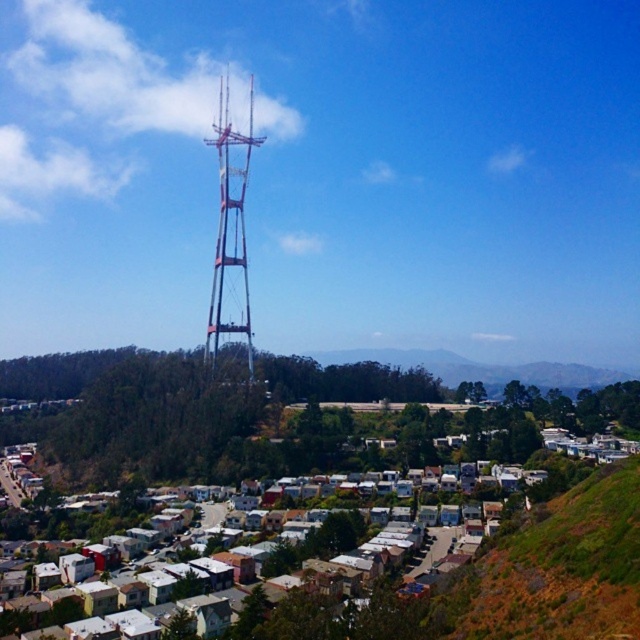
You are a drone operator planning to fly your drone from the green grassy hillside at lower right to the metallic silver tower at center. Based on the scene, will the tower be visible from the hillside without any obstructions?

Yes, the green grassy hillside at lower right is in front of the metallic silver tower at center, meaning there are no obstructions between them. The tower should be visible from the hillside.

You are standing at the base of the metallic silver tower at center and want to walk to the green grassy hillside at lower right. Which direction should you head?

The green grassy hillside at lower right is to the right of the metallic silver tower at center, so you should head to the right to reach it.

You are standing at the base of the tall red and white communication tower and want to reach the green grassy hillside at lower right. According to the map coordinates, the point you need to reach is at coordinate (556, 568). What is the direction you should head towards from the tower to reach the green grassy hillside at lower right?

The point at coordinate (556, 568) indicates the green grassy hillside at lower right, so you should head towards the lower right direction from the tower to reach it.